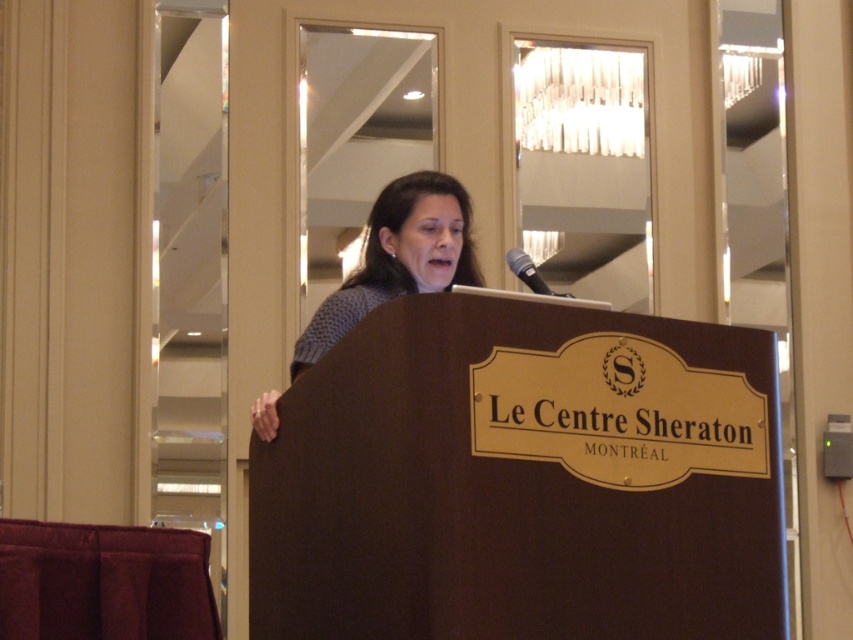
You are an event organizer who needs to ensure all items on the podium are visible to the audience. The knitted sweater at center and the black metallic microphone at upper center are both on the podium. Based on their sizes, which item might block the other from view?

The knitted sweater at center is wider than the black metallic microphone at upper center, so it might block the microphone from view if placed too close.

You are standing at the base of the staircase in the conference center. You see two points marked on the floor. The first point is at coordinate point (347, 301) and the second is at point (521, 260). If you want to walk towards the back of the room, which point should you head towards?

Point (521, 260) is in front of point (347, 301), so to go to the back of the room, you should head towards point (347, 301).

Where is the knitted sweater at center located in the image?

The knitted sweater at center is located at point (398,257) in the image.